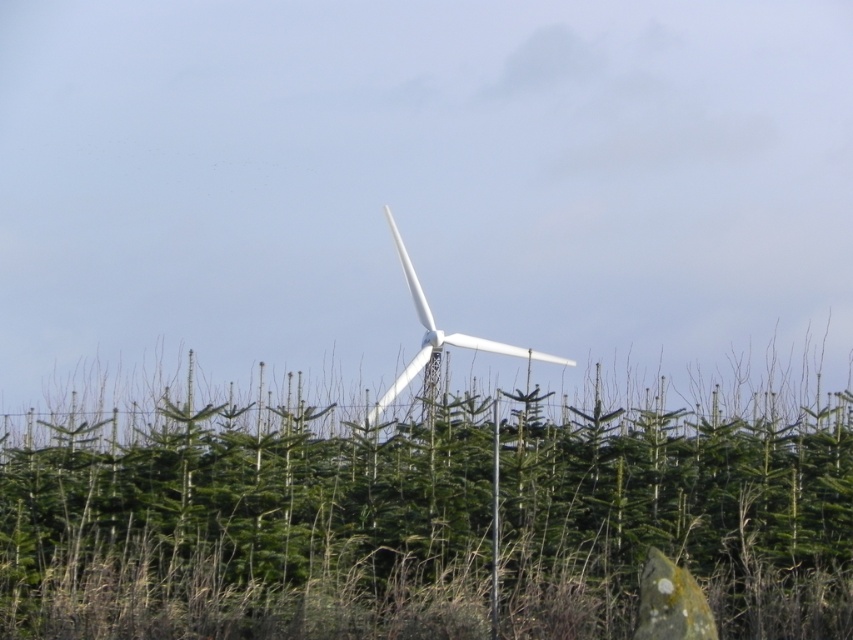
Question: Considering the relative positions of green matte tree at center and white matte wind turbine at center in the image provided, where is green matte tree at center located with respect to white matte wind turbine at center?

Choices:
 (A) above
 (B) below

Answer: (B)

Question: Which point is closer to the camera?

Choices:
 (A) (419, 285)
 (B) (299, 404)

Answer: (B)

Question: Can you confirm if green matte tree at center is positioned to the left of white matte wind turbine at center?

Choices:
 (A) yes
 (B) no

Answer: (B)

Question: Does green matte tree at center lie in front of white matte wind turbine at center?

Choices:
 (A) no
 (B) yes

Answer: (B)